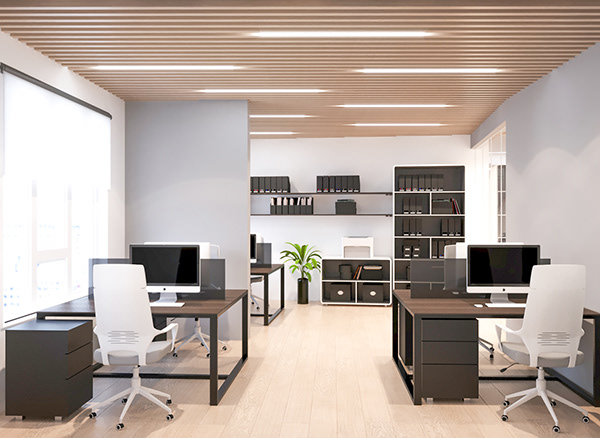
The width and height of the screenshot is (600, 438). Identify the location of partition. (434, 282), (213, 276), (263, 257).